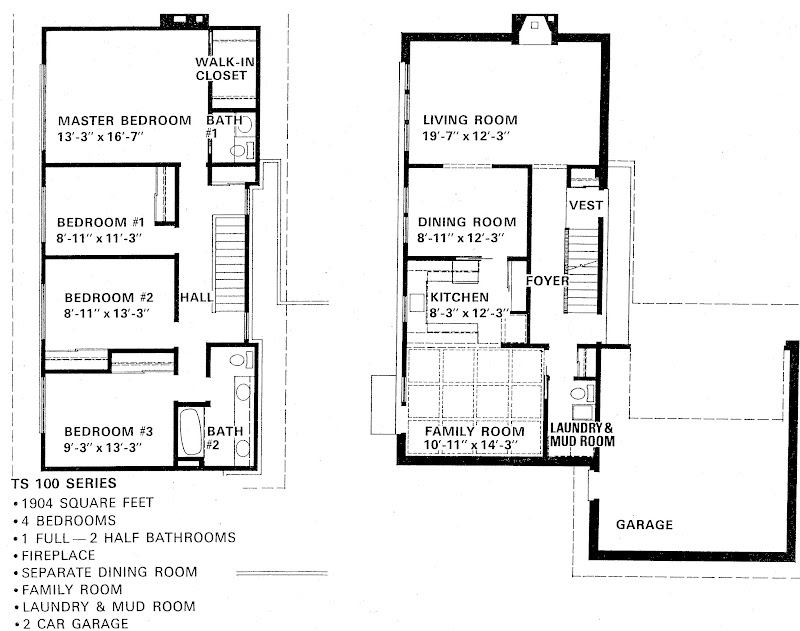
At what (x,y) coordinates should I click in order to perform the action: click on foyer. Please return your answer as a coordinate pair (x, y). This screenshot has height=631, width=800. Looking at the image, I should click on (556, 203).